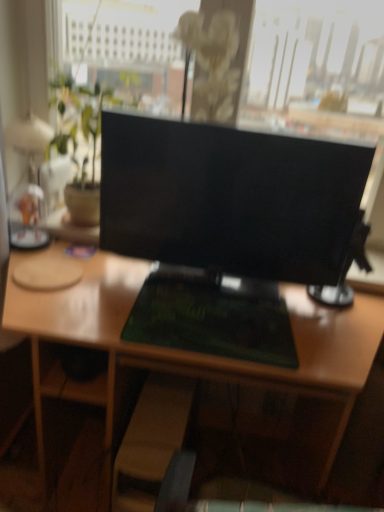
Question: Considering the relative sizes of black glossy monitor at center and wooden swivel chair at lower center in the image provided, is black glossy monitor at center thinner than wooden swivel chair at lower center?

Choices:
 (A) no
 (B) yes

Answer: (B)

Question: From a real-world perspective, is black glossy monitor at center beneath wooden swivel chair at lower center?

Choices:
 (A) yes
 (B) no

Answer: (B)

Question: Is black glossy monitor at center positioned far away from wooden swivel chair at lower center?

Choices:
 (A) no
 (B) yes

Answer: (A)

Question: Does black glossy monitor at center have a larger size compared to wooden swivel chair at lower center?

Choices:
 (A) yes
 (B) no

Answer: (A)

Question: Would you say black glossy monitor at center is outside wooden swivel chair at lower center?

Choices:
 (A) yes
 (B) no

Answer: (A)

Question: From the image's perspective, does black glossy monitor at center appear lower than wooden swivel chair at lower center?

Choices:
 (A) yes
 (B) no

Answer: (B)

Question: Does black glossy monitor at center have a greater height compared to green matte desk at center?

Choices:
 (A) yes
 (B) no

Answer: (B)

Question: Is black glossy monitor at center located outside green matte desk at center?

Choices:
 (A) no
 (B) yes

Answer: (B)

Question: Is black glossy monitor at center oriented towards green matte desk at center?

Choices:
 (A) yes
 (B) no

Answer: (B)

Question: From a real-world perspective, is black glossy monitor at center on top of green matte desk at center?

Choices:
 (A) yes
 (B) no

Answer: (A)

Question: Can you confirm if black glossy monitor at center is bigger than green matte desk at center?

Choices:
 (A) yes
 (B) no

Answer: (B)

Question: Can you see black glossy monitor at center touching green matte desk at center?

Choices:
 (A) yes
 (B) no

Answer: (B)

Question: From a real-world perspective, is green matte desk at center below wooden swivel chair at lower center?

Choices:
 (A) no
 (B) yes

Answer: (A)